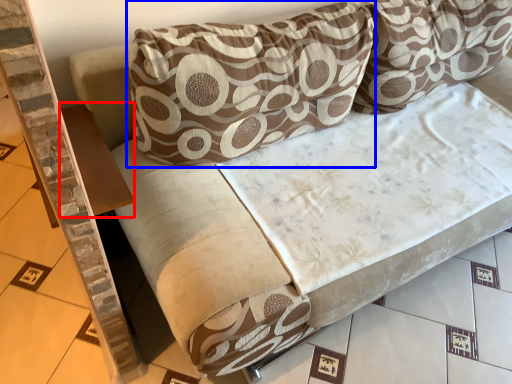
Question: Among these objects, which one is nearest to the camera, table (highlighted by a red box) or pillow (highlighted by a blue box)?

Choices:
 (A) table
 (B) pillow

Answer: (B)